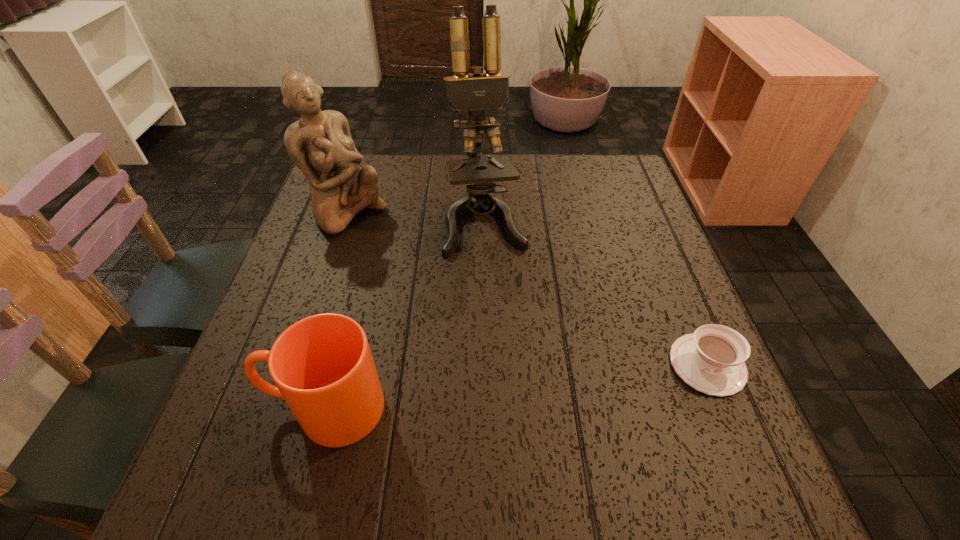
You are a GUI agent. You are given a task and a screenshot of the screen. Output one action in this format:
    pyautogui.click(x=<x>, y=<y>)
    Task: Click on the free space between the shortest object and the mug
    
    Given the screenshot: What is the action you would take?
    (x=516, y=387)

The image size is (960, 540). Find the location of `free space between the teacup and the third shortest object`. free space between the teacup and the third shortest object is located at coordinates (528, 289).

Where is `free space between the mug and the figurine`? This screenshot has height=540, width=960. free space between the mug and the figurine is located at coordinates (337, 310).

Find the location of a particular element. This screenshot has width=960, height=540. vacant space that is in between the third shortest object and the microscope is located at coordinates (417, 218).

You are a GUI agent. You are given a task and a screenshot of the screen. Output one action in this format:
    pyautogui.click(x=<x>, y=<y>)
    Task: Click on the free space between the teacup and the mug
    The width and height of the screenshot is (960, 540).
    Given the screenshot: What is the action you would take?
    pyautogui.click(x=516, y=387)

Where is `vacant space that is in between the shortest object and the figurine`? Image resolution: width=960 pixels, height=540 pixels. vacant space that is in between the shortest object and the figurine is located at coordinates (528, 289).

Where is `free spot between the tallest object and the teacup`? The height and width of the screenshot is (540, 960). free spot between the tallest object and the teacup is located at coordinates (596, 294).

The image size is (960, 540). Find the location of `object that is the second closest to the third shortest object`. object that is the second closest to the third shortest object is located at coordinates (322, 365).

You are a GUI agent. You are given a task and a screenshot of the screen. Output one action in this format:
    pyautogui.click(x=<x>, y=<y>)
    Task: Click on the object that is the closest to the shortest object
    
    Given the screenshot: What is the action you would take?
    pyautogui.click(x=474, y=92)

Find the location of a particular element. This screenshot has height=540, width=960. vacant space that satisfies the following two spatial constraints: 1. on the front side of the second tallest object; 2. on the handle side of the mug is located at coordinates (283, 408).